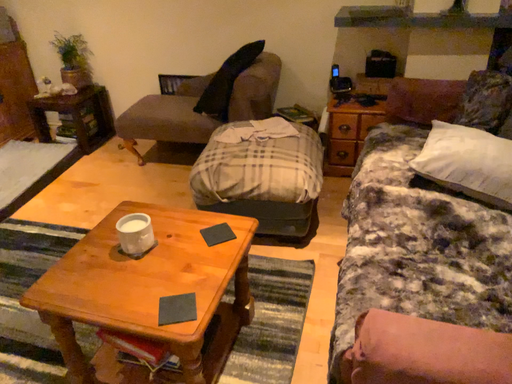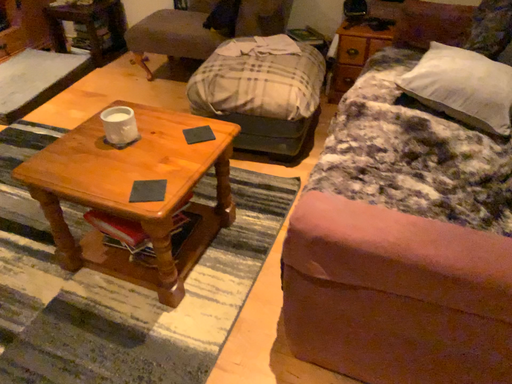
Question: How did the camera likely rotate when shooting the video?

Choices:
 (A) rotated downward
 (B) rotated upward

Answer: (A)